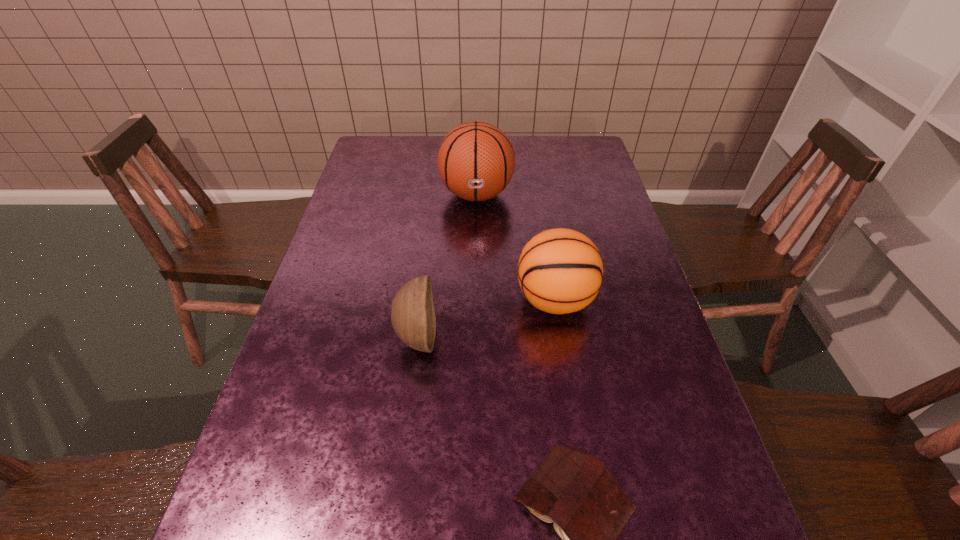
You are a GUI agent. You are given a task and a screenshot of the screen. Output one action in this format:
    pyautogui.click(x=<x>, y=<y>)
    Task: Click on the vacant region at the right edge of the desktop
    Image resolution: width=960 pixels, height=540 pixels.
    Given the screenshot: What is the action you would take?
    pyautogui.click(x=612, y=409)

Where is `free spot at the far left corner of the desktop`? free spot at the far left corner of the desktop is located at coordinates (398, 143).

Find the location of a particular element. vacant space at the far right corner of the desktop is located at coordinates (583, 165).

This screenshot has width=960, height=540. I want to click on vacant space in between the tallest object and the third tallest object, so click(x=446, y=266).

This screenshot has width=960, height=540. I want to click on vacant space that's between the shorter basketball and the taller basketball, so click(x=516, y=247).

The width and height of the screenshot is (960, 540). What are the coordinates of `unoccupied position between the bowl and the shorter basketball` in the screenshot? It's located at (486, 319).

You are a GUI agent. You are given a task and a screenshot of the screen. Output one action in this format:
    pyautogui.click(x=<x>, y=<y>)
    Task: Click on the unoccupied area between the bowl and the farther basketball
    
    Given the screenshot: What is the action you would take?
    pyautogui.click(x=446, y=266)

Image resolution: width=960 pixels, height=540 pixels. I want to click on object that stands as the closest to the bowl, so click(x=560, y=271).

Locate which object ranks in proximity to the farther basketball. Please provide its 2D coordinates. Your answer should be formatted as a tuple, i.e. [(x, y)], where the tuple contains the x and y coordinates of a point satisfying the conditions above.

[(560, 271)]

This screenshot has width=960, height=540. I want to click on vacant space that satisfies the following two spatial constraints: 1. on the back side of the bowl; 2. on the right side of the shorter basketball, so click(x=422, y=300).